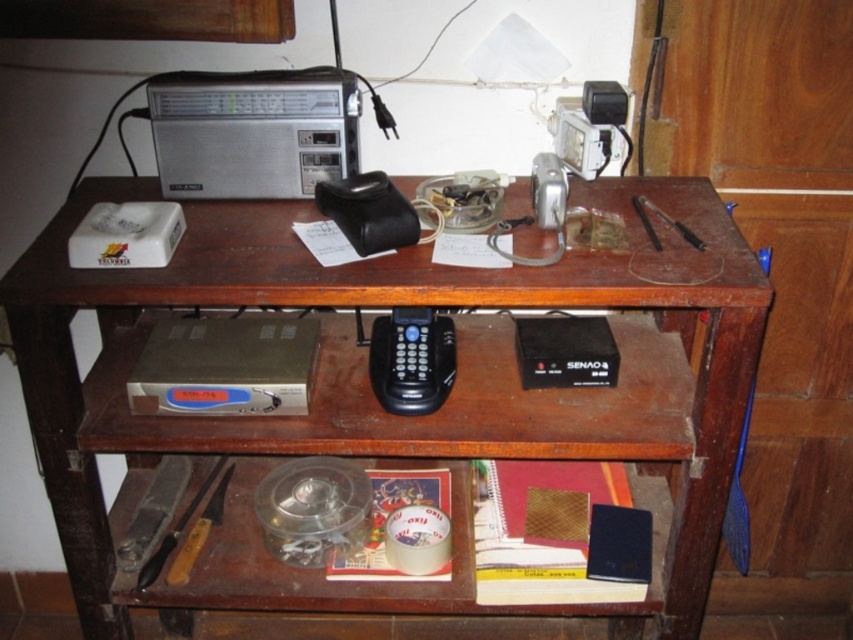
Question: Is silver metallic radio at upper left below metallic gray tool at lower left?

Choices:
 (A) yes
 (B) no

Answer: (B)

Question: Which object is positioned farthest from the black plastic phone at center?

Choices:
 (A) wooden-handled knife at lower left
 (B) brown wooden table at center
 (C) silver metallic radio at upper left
 (D) metallic gray tool at lower left

Answer: (D)

Question: Is the position of black plastic phone at center less distant than that of wooden-handled knife at lower left?

Choices:
 (A) no
 (B) yes

Answer: (B)

Question: Can you confirm if brown wooden table at center is positioned below metallic gray tool at lower left?

Choices:
 (A) no
 (B) yes

Answer: (A)

Question: Based on their relative distances, which object is farther from the metallic gray tool at lower left?

Choices:
 (A) black plastic phone at center
 (B) brown wooden table at center
 (C) wooden-handled knife at lower left
 (D) metallic pen at upper center

Answer: (D)

Question: Which object is closer to the camera taking this photo?

Choices:
 (A) metallic pen at upper center
 (B) metallic gray tool at lower left
 (C) brown wooden table at center
 (D) black plastic phone at center

Answer: (C)